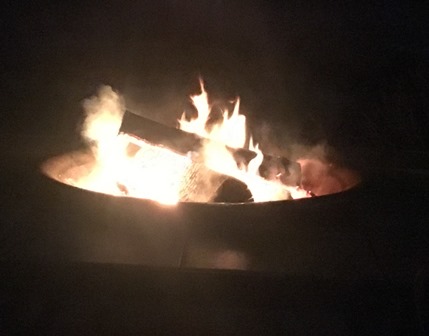
Locate an element on the screen. This screenshot has height=336, width=429. light is located at coordinates (137, 179).